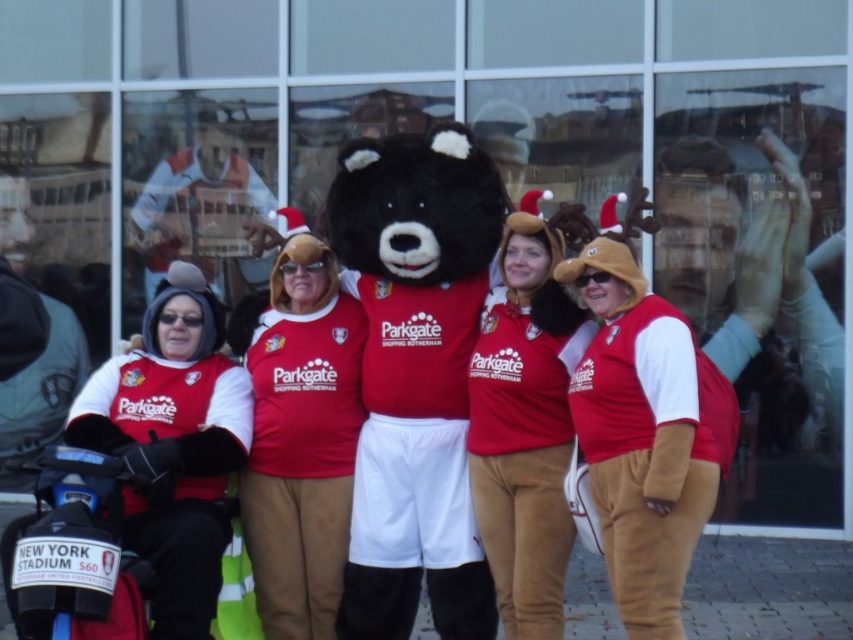
Question: Which point appears farthest from the camera in this image?

Choices:
 (A) click(558, 349)
 (B) click(392, 344)

Answer: (B)

Question: Based on their relative distances, which object is nearer to the black plush bear at center?

Choices:
 (A) matte red jersey at center
 (B) matte red vest at left
 (C) velvet brown teddy bear at center

Answer: (A)

Question: Can you confirm if matte red vest at left is bigger than velvet brown teddy bear at center?

Choices:
 (A) no
 (B) yes

Answer: (B)

Question: Among these objects, which one is farthest from the camera?

Choices:
 (A) matte red jersey at center
 (B) velvet brown teddy bear at center
 (C) black plush bear at center
 (D) matte red vest at left

Answer: (A)

Question: Does matte red jersey at center have a larger size compared to matte red vest at left?

Choices:
 (A) yes
 (B) no

Answer: (B)

Question: Can you confirm if matte red jersey at center is positioned to the left of velvet brown teddy bear at center?

Choices:
 (A) no
 (B) yes

Answer: (B)